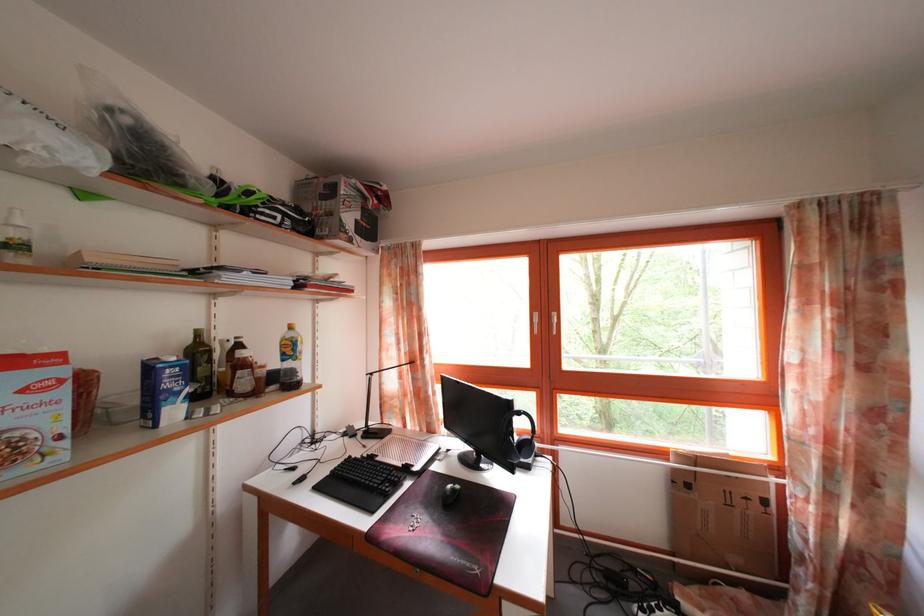
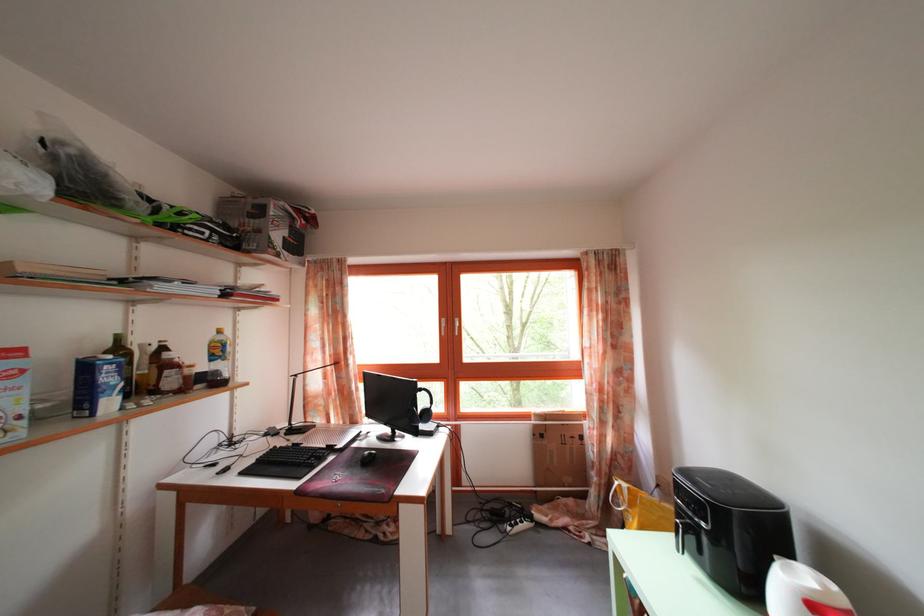
In the second image, find the point that corresponds to point (181, 418) in the first image.

(117, 410)